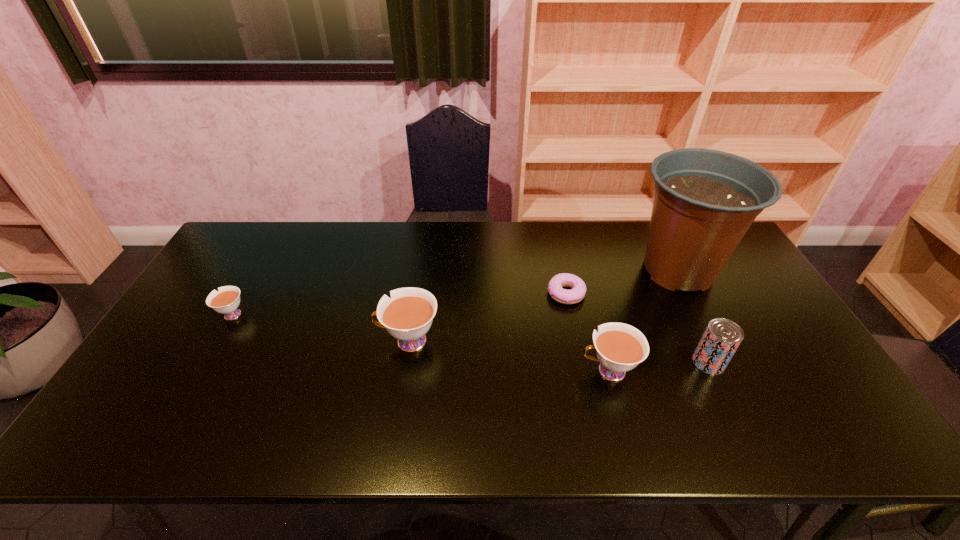
What are the coordinates of `the shortest teacup` in the screenshot? It's located at (226, 301).

Where is `the leftmost object`? This screenshot has width=960, height=540. the leftmost object is located at coordinates (226, 301).

I want to click on the fifth object from right to left, so click(x=408, y=315).

This screenshot has width=960, height=540. Identify the location of the rightmost teacup. (620, 347).

Locate an element on the screen. the tallest object is located at coordinates (705, 200).

The width and height of the screenshot is (960, 540). I want to click on beer can, so click(x=721, y=338).

Locate an element on the screen. The width and height of the screenshot is (960, 540). doughnut is located at coordinates (576, 294).

Find the location of a particular element. free point located 0.240m on the side of the second teacup from left to right with the handle is located at coordinates (288, 341).

I want to click on vacant region located 0.190m on the side of the second teacup from left to right with the handle, so click(x=306, y=341).

The image size is (960, 540). In order to click on vacant area situated 0.170m on the side of the second teacup from left to right with the handle in this screenshot , I will do `click(314, 341)`.